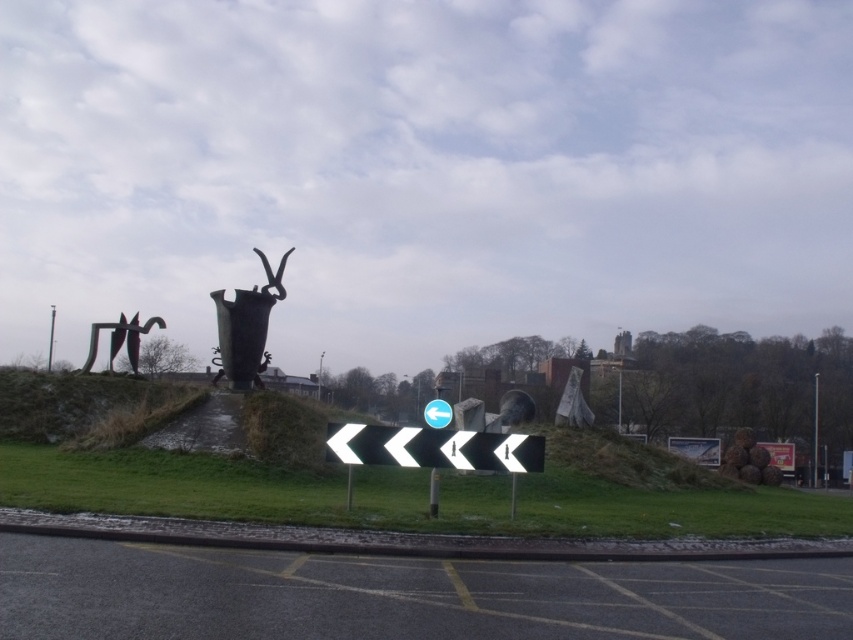
You are a driver approaching the intersection and see both the white plastic arrow at center and the polished bronze sculpture at left. Which object will appear taller to you?

The polished bronze sculpture at left is taller than the white plastic arrow at center, so it will appear taller to you.

You are driving a car and see the white plastic arrow at center and the polished bronze sculpture at left. Which object is located above the other?

The polished bronze sculpture at left is above the white plastic arrow at center because the white plastic arrow at center is positioned under it.

You are standing at the entrance of the parking lot and want to locate the polished bronze vase at center. According to the coordinates provided, where should you look relative to your current position?

The polished bronze vase at center is located at coordinates point (247, 326), which means it is positioned slightly to the right and forward from your current position at the entrance.